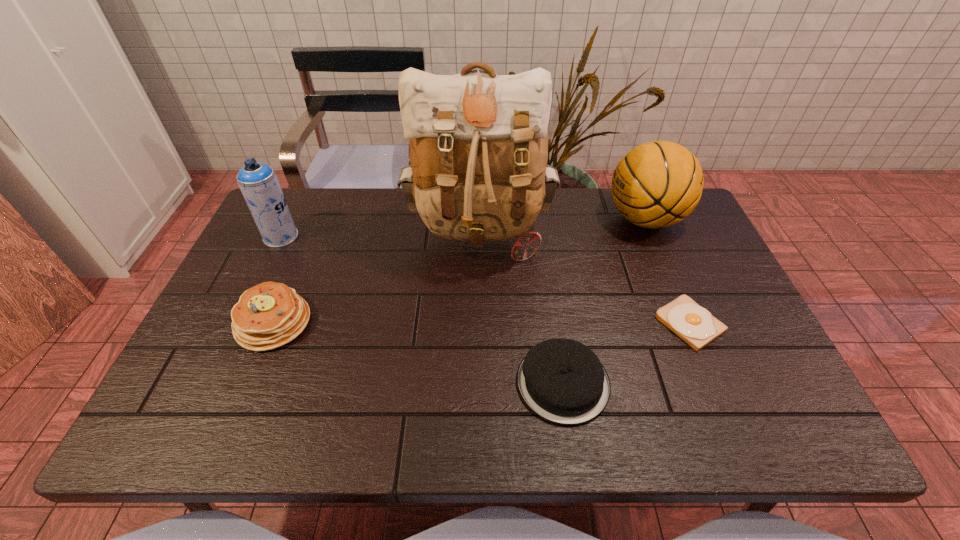
This screenshot has width=960, height=540. Find the location of `empty space between the basketball and the right pancake`. empty space between the basketball and the right pancake is located at coordinates (604, 301).

I want to click on vacant region between the shortest object and the tallest object, so click(x=585, y=280).

Where is `vacant region between the aerosol can and the tallest object`? The height and width of the screenshot is (540, 960). vacant region between the aerosol can and the tallest object is located at coordinates (380, 236).

At what (x,y) coordinates should I click in order to perform the action: click on free point between the taller pancake and the tallest object. Please return your answer as a coordinate pair (x, y). Image resolution: width=960 pixels, height=540 pixels. Looking at the image, I should click on (376, 279).

At what (x,y) coordinates should I click in order to perform the action: click on free space that is in between the shortest object and the basketball. Please return your answer as a coordinate pair (x, y). The image size is (960, 540). Looking at the image, I should click on (667, 271).

Locate an element on the screen. free space between the backpack and the aerosol can is located at coordinates (380, 236).

The image size is (960, 540). I want to click on vacant space that is in between the backpack and the aerosol can, so click(x=380, y=236).

The image size is (960, 540). I want to click on free space between the backpack and the aerosol can, so click(380, 236).

I want to click on free space between the shortest object and the aerosol can, so click(x=486, y=280).

At what (x,y) coordinates should I click in order to perform the action: click on free space between the second shortest object and the backpack. Please return your answer as a coordinate pair (x, y). This screenshot has height=540, width=960. Looking at the image, I should click on (521, 309).